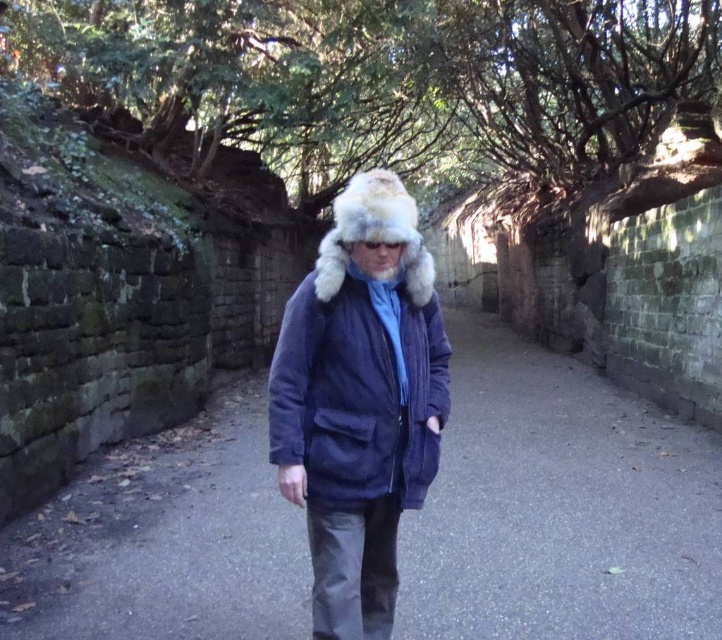
Describe the element at coordinates (560, 508) in the screenshot. I see `navy blue fur-lined coat at center` at that location.

Based on the photo, does navy blue fur-lined coat at center have a greater height compared to white fur hat at center?

Incorrect, navy blue fur-lined coat at center's height is not larger of white fur hat at center's.

Is point (201, 614) positioned before point (352, 211)?

No, (201, 614) is further to viewer.

Locate an element on the screen. The width and height of the screenshot is (722, 640). navy blue fur-lined coat at center is located at coordinates (560, 508).

Who is more distant from viewer, (316, 344) or (406, 196)?

Positioned behind is point (316, 344).

Does navy corduroy jacket at center have a greater width compared to white fur hat at center?

Yes.

The width and height of the screenshot is (722, 640). I want to click on navy corduroy jacket at center, so click(357, 385).

Which is in front, point (517, 384) or point (282, 429)?

Point (282, 429) is in front.

What do you see at coordinates (560, 508) in the screenshot? The height and width of the screenshot is (640, 722). I see `navy blue fur-lined coat at center` at bounding box center [560, 508].

You are a GUI agent. You are given a task and a screenshot of the screen. Output one action in this format:
    pyautogui.click(x=<x>, y=<y>)
    Task: Click on the navy blue fur-lined coat at center
    The width and height of the screenshot is (722, 640).
    Given the screenshot: What is the action you would take?
    pyautogui.click(x=560, y=508)

Locate an element on the screen. navy blue fur-lined coat at center is located at coordinates (560, 508).